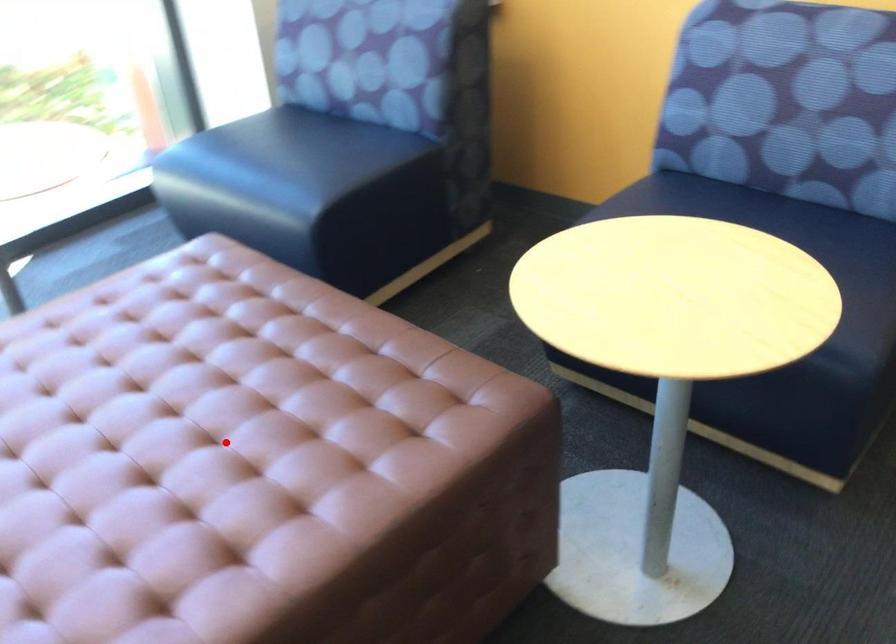
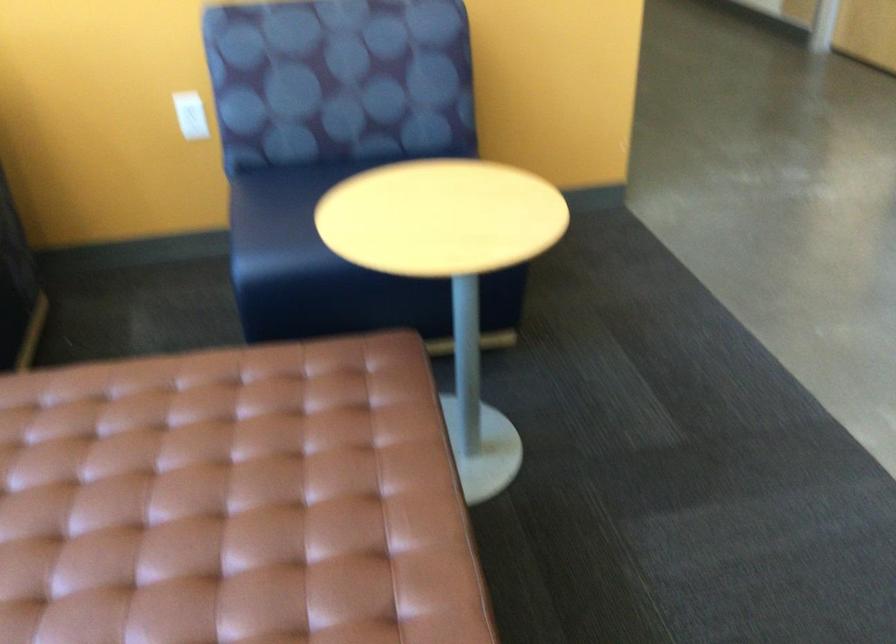
Locate, in the second image, the point that corresponds to the highlighted location in the first image.

(231, 502)